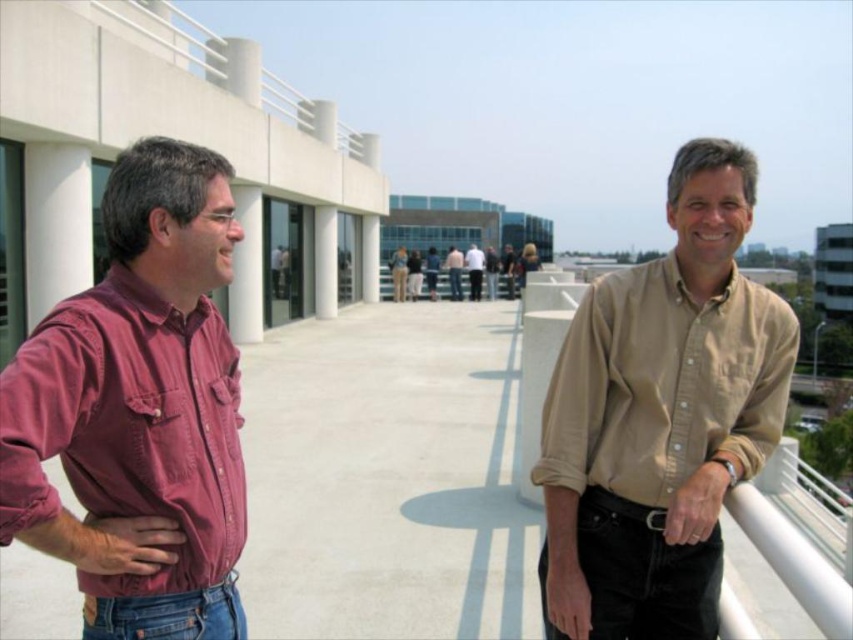
Question: Considering the real-world distances, which object is farthest from the beige cotton shirt at right?

Choices:
 (A) tan shirt at center
 (B) black denim jeans at right

Answer: (A)

Question: Is denim jeans at lower left bigger than light beige shirt at center?

Choices:
 (A) yes
 (B) no

Answer: (B)

Question: Based on their relative distances, which object is farther from the tan shirt at center?

Choices:
 (A) denim jeans at lower left
 (B) light beige shirt at center

Answer: (A)

Question: Is beige cotton shirt at right to the left of tan shirt at center from the viewer's perspective?

Choices:
 (A) yes
 (B) no

Answer: (A)

Question: Among these points, which one is nearest to the camera?

Choices:
 (A) (648, 547)
 (B) (154, 428)

Answer: (B)

Question: Does light beige shirt at center have a greater width compared to tan shirt at center?

Choices:
 (A) yes
 (B) no

Answer: (B)